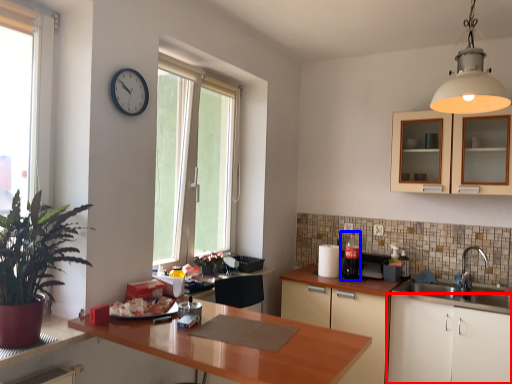
Question: Which of the following is the farthest to the observer, cabinetry (highlighted by a red box) or appliance (highlighted by a blue box)?

Choices:
 (A) cabinetry
 (B) appliance

Answer: (B)